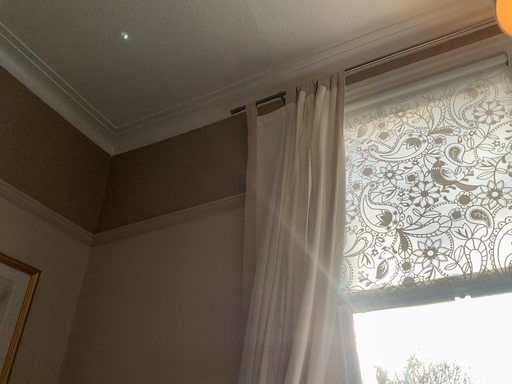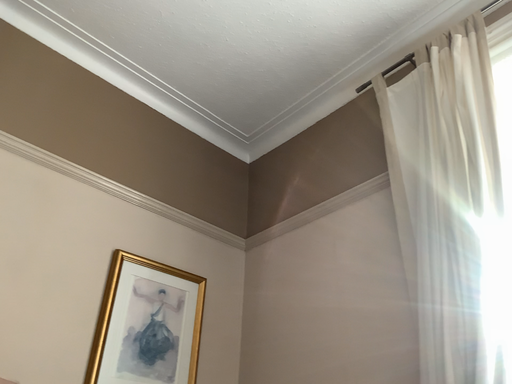
Question: How did the camera likely rotate when shooting the video?

Choices:
 (A) rotated right
 (B) rotated left

Answer: (B)